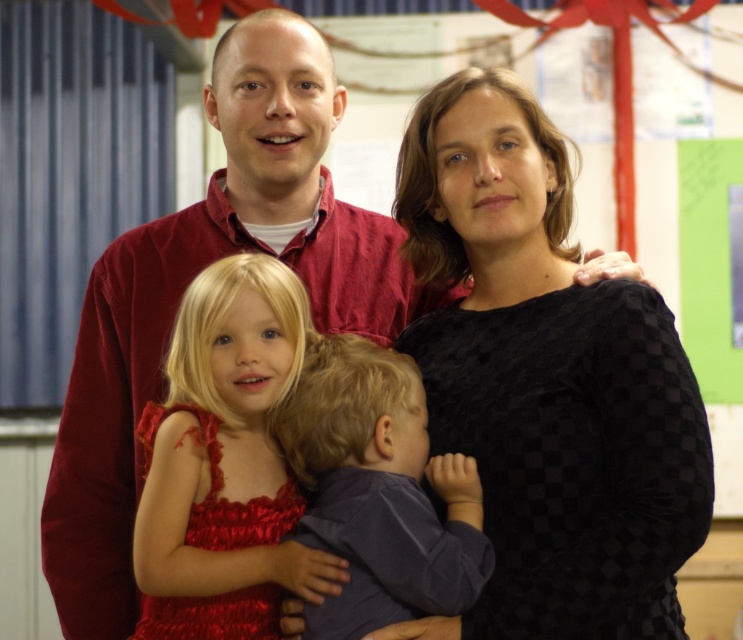
Does black checkered dress at center appear over matte purple shirt at center?

Correct, black checkered dress at center is located above matte purple shirt at center.

Between point (635, 401) and point (418, 536), which one is positioned behind?

Point (635, 401)

This screenshot has height=640, width=743. Find the location of `black checkered dress at center`. black checkered dress at center is located at coordinates (545, 380).

How much distance is there between black checkered dress at center and shiny red dress at center?

black checkered dress at center is 14.17 inches from shiny red dress at center.

Does black checkered dress at center appear over shiny red dress at center?

Yes, black checkered dress at center is above shiny red dress at center.

Identify the location of black checkered dress at center. (545, 380).

At what (x,y) coordinates should I click in order to perform the action: click on black checkered dress at center. Please return your answer as a coordinate pair (x, y). This screenshot has width=743, height=640. Looking at the image, I should click on (545, 380).

Can you confirm if shiny red dress at center is wider than matte purple shirt at center?

Yes, shiny red dress at center is wider than matte purple shirt at center.

Which is below, shiny red dress at center or matte purple shirt at center?

matte purple shirt at center is lower down.

What do you see at coordinates (224, 461) in the screenshot?
I see `shiny red dress at center` at bounding box center [224, 461].

The image size is (743, 640). I want to click on shiny red dress at center, so click(224, 461).